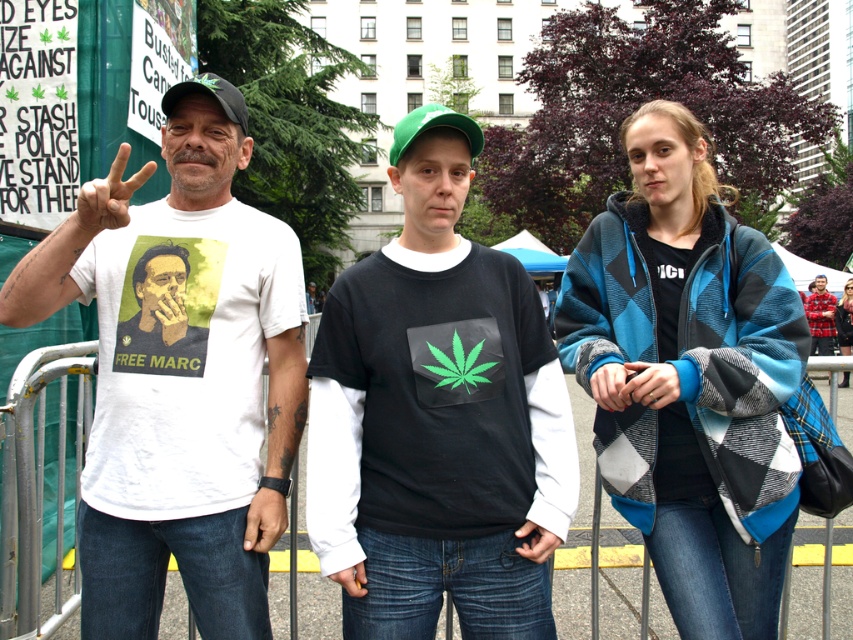
Which individual is the point at coordinate (183, 381) located on?

The point at coordinate (183, 381) is located on the white cotton t shirt at left.